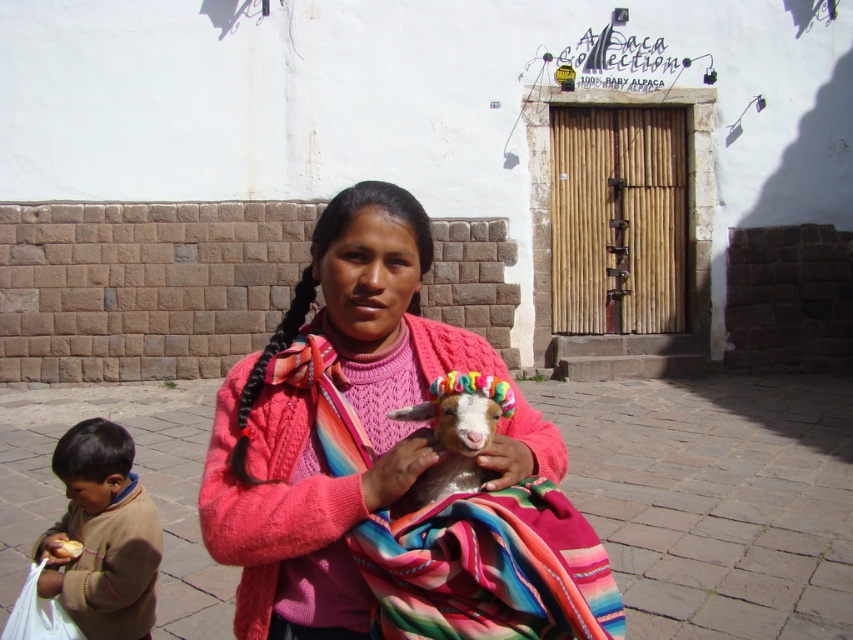
You are a traveler who wants to sit on the multicolored woven blanket at center to take a photo with the brown wool sweater at lower left. Can you place the sweater on the blanket so that both items are visible in the photo?

The multicolored woven blanket at center might be wider than brown wool sweater at lower left, so there is a possibility that the sweater can be placed on the blanket and both items can be visible in the photo.

Looking at this image, you are a fashion designer observing the scene. You need to decide which item is shorter between the brown wool sweater at lower left and the black silky pigtail at center. Which one should you choose?

The brown wool sweater at lower left is not as tall as the black silky pigtail at center, so the brown wool sweater at lower left is shorter.

You are a photographer trying to capture a clear photo of the white woolen goat at center. However, the brown wool sweater at lower left is blocking your view. Can you move the sweater to get a clear shot?

The white woolen goat at center is behind the brown wool sweater at lower left, so moving the brown wool sweater at lower left would allow you to see the goat clearly.